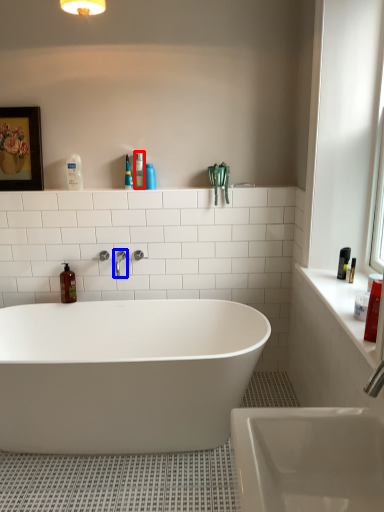
Question: Among these objects, which one is farthest to the camera, toiletry (highlighted by a red box) or tap (highlighted by a blue box)?

Choices:
 (A) toiletry
 (B) tap

Answer: (A)